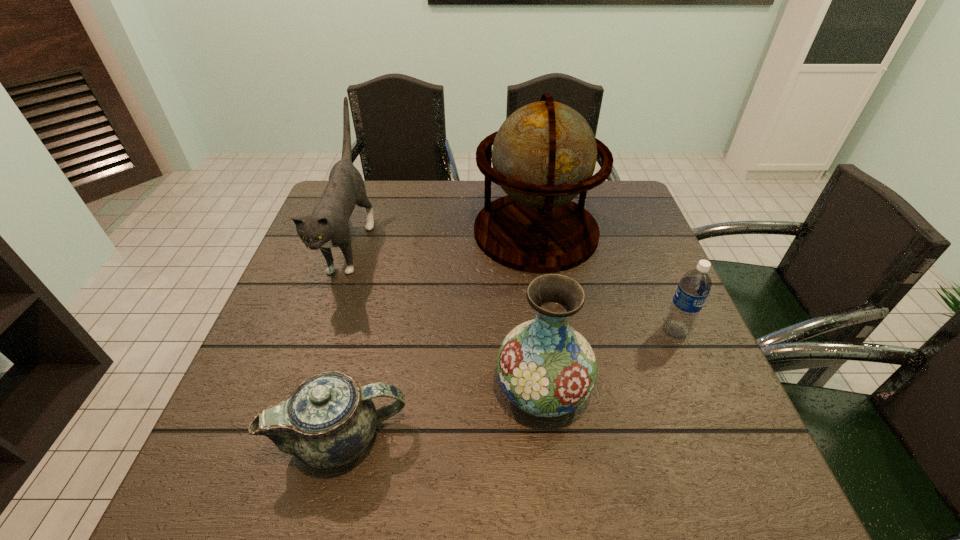
Where is `globe`? globe is located at coordinates (544, 154).

Identify the location of cat. (328, 226).

The width and height of the screenshot is (960, 540). Identify the location of the third tallest object. (546, 368).

The height and width of the screenshot is (540, 960). In order to click on the fourth tallest object in this screenshot , I will do `click(694, 287)`.

Where is `the third nearest object`? The height and width of the screenshot is (540, 960). the third nearest object is located at coordinates (694, 287).

Locate an element on the screen. This screenshot has height=540, width=960. the shortest object is located at coordinates [x=329, y=420].

Identify the location of vacant region located on the front-facing side of the globe. Image resolution: width=960 pixels, height=540 pixels. (549, 318).

Where is `vacant space located at the face of the second tallest object`? Image resolution: width=960 pixels, height=540 pixels. vacant space located at the face of the second tallest object is located at coordinates (292, 413).

Locate an element on the screen. vacant space situated on the right of the vase is located at coordinates (630, 388).

This screenshot has width=960, height=540. I want to click on vacant space located 0.150m on the back of the second shortest object, so click(652, 276).